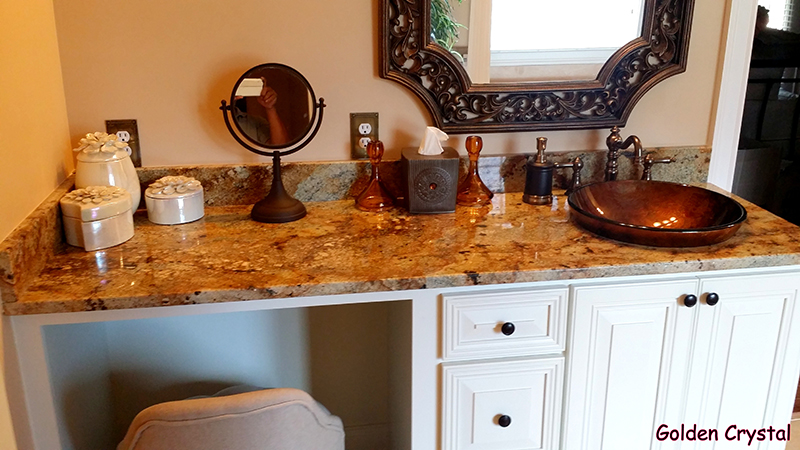
Where is `chair`? This screenshot has height=450, width=800. chair is located at coordinates (258, 427).